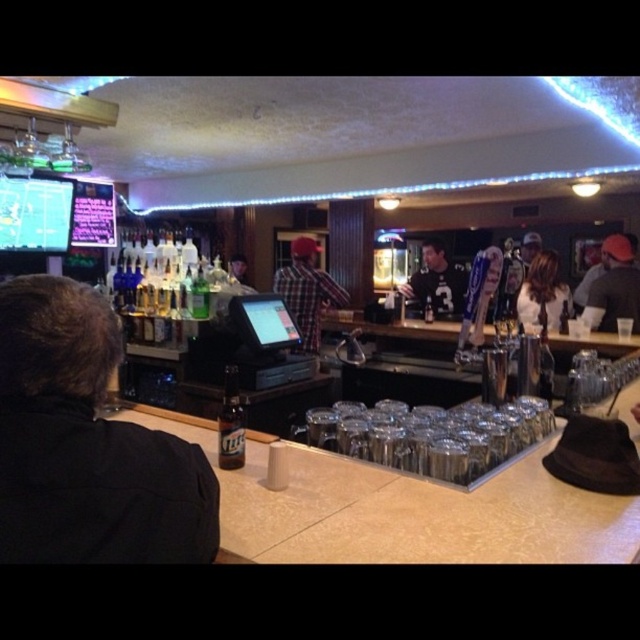
Question: Does black leather jacket at left appear on the left side of matte black shirt at center?

Choices:
 (A) no
 (B) yes

Answer: (B)

Question: Which of the following is the farthest from the observer?

Choices:
 (A) (301, 252)
 (B) (417, 285)

Answer: (B)

Question: Which point appears farthest from the camera in this image?

Choices:
 (A) (54, 506)
 (B) (627, 314)
 (C) (525, 282)

Answer: (C)

Question: Can you confirm if plaid fabric shirt at center is thinner than matte black shirt at center?

Choices:
 (A) no
 (B) yes

Answer: (B)

Question: Which point is farther from the camera taking this photo?

Choices:
 (A) (29, 349)
 (B) (406, 292)
 (C) (240, 449)
 (D) (616, 310)

Answer: (B)

Question: Does shiny brown hair at center appear under clear glass bottle at bar center?

Choices:
 (A) yes
 (B) no

Answer: (B)